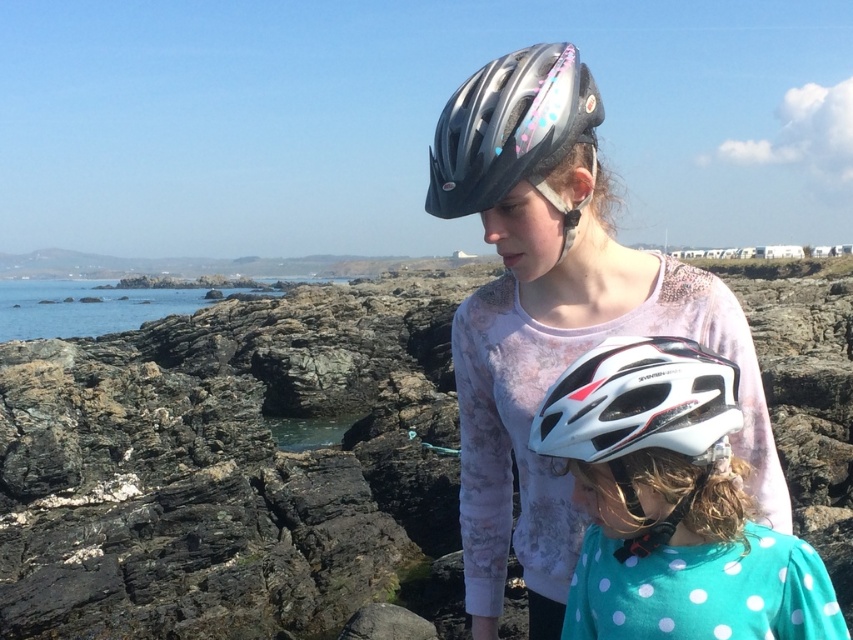
Question: Which object is closer to the camera taking this photo?

Choices:
 (A) white matte helmet at center
 (B) shiny metallic helmet at upper center

Answer: (A)

Question: Is shiny black helmet at center positioned before white matte helmet at center?

Choices:
 (A) no
 (B) yes

Answer: (A)

Question: Which point is farther to the camera?

Choices:
 (A) (508, 104)
 (B) (607, 604)
 (C) (114, 524)
 (D) (672, 378)

Answer: (C)

Question: Is rough textured rocks at center below white matte bicycle helmet at center?

Choices:
 (A) no
 (B) yes

Answer: (A)

Question: Does shiny black helmet at center appear over white matte helmet at center?

Choices:
 (A) yes
 (B) no

Answer: (A)

Question: Which object is the farthest from the shiny metallic helmet at upper center?

Choices:
 (A) white matte helmet at center
 (B) white matte bicycle helmet at center

Answer: (B)